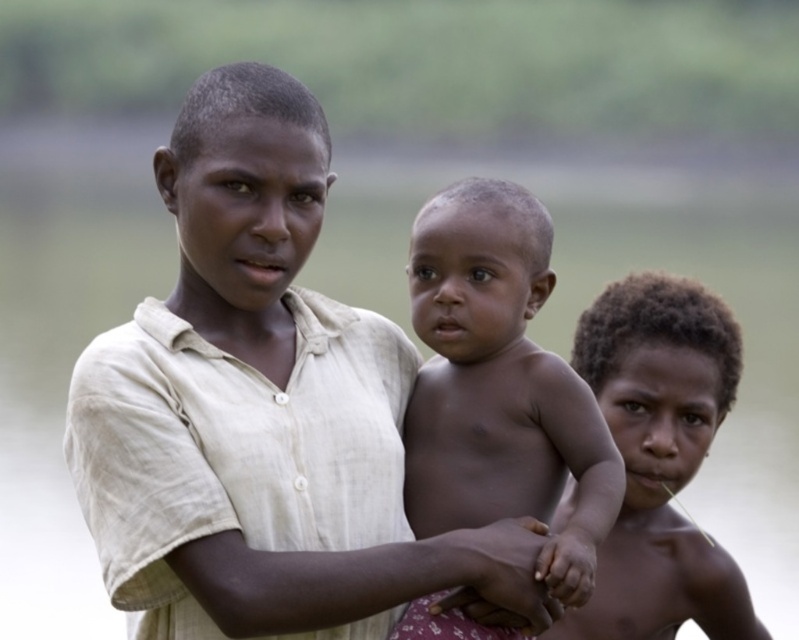
Question: Which of the following is the farthest from the observer?

Choices:
 (A) smooth skin baby at center
 (B) smooth skin hand at center

Answer: (B)

Question: Can you confirm if dark brown skin at center is wider than smooth skin hand at center?

Choices:
 (A) no
 (B) yes

Answer: (B)

Question: Among these points, which one is nearest to the camera?

Choices:
 (A) (483, 442)
 (B) (678, 548)

Answer: (A)

Question: Does dark brown skin at center lie in front of smooth skin hand at center?

Choices:
 (A) yes
 (B) no

Answer: (B)

Question: Which object appears closest to the camera in this image?

Choices:
 (A) smooth skin baby at center
 (B) dark brown skin at center

Answer: (A)

Question: Is dark brown skin at center thinner than smooth skin hand at center?

Choices:
 (A) no
 (B) yes

Answer: (A)